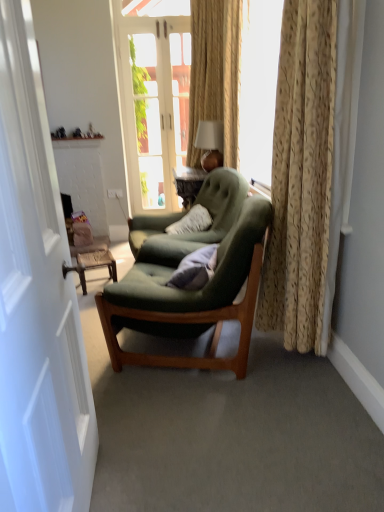
Question: Which direction should I rotate to look at white glass door at center, which is the second door in front-to-back order?

Choices:
 (A) right
 (B) left

Answer: (B)

Question: Should I look upward or downward to see gold textured curtain at right?

Choices:
 (A) up
 (B) down

Answer: (A)

Question: Is velvet blue pillow at center next to white glass door at center, which is the second door in front-to-back order, and touching it?

Choices:
 (A) yes
 (B) no

Answer: (B)

Question: From a real-world perspective, is velvet blue pillow at center over white glass door at center, which is the second door in front-to-back order?

Choices:
 (A) no
 (B) yes

Answer: (A)

Question: Can you confirm if velvet blue pillow at center is wider than white glass door at center, the first door viewed from the top?

Choices:
 (A) yes
 (B) no

Answer: (A)

Question: From the image's perspective, is velvet blue pillow at center under white glass door at center, acting as the 2th door starting from the bottom?

Choices:
 (A) no
 (B) yes

Answer: (B)

Question: Is velvet blue pillow at center far from white glass door at center, which is the first door in back-to-front order?

Choices:
 (A) yes
 (B) no

Answer: (A)

Question: From the image's perspective, is velvet blue pillow at center located above white glass door at center, the first door viewed from the top?

Choices:
 (A) yes
 (B) no

Answer: (B)

Question: Can you confirm if matte white table lamp at upper center is positioned to the left of velvet blue pillow at center?

Choices:
 (A) yes
 (B) no

Answer: (B)

Question: Is matte white table lamp at upper center wider than velvet blue pillow at center?

Choices:
 (A) no
 (B) yes

Answer: (B)

Question: Would you say matte white table lamp at upper center is a long distance from velvet blue pillow at center?

Choices:
 (A) yes
 (B) no

Answer: (A)

Question: Does matte white table lamp at upper center lie behind velvet blue pillow at center?

Choices:
 (A) yes
 (B) no

Answer: (A)

Question: Can you confirm if matte white table lamp at upper center is smaller than velvet blue pillow at center?

Choices:
 (A) yes
 (B) no

Answer: (B)

Question: Is matte white table lamp at upper center turned away from velvet blue pillow at center?

Choices:
 (A) no
 (B) yes

Answer: (A)

Question: From the image's perspective, is velvet blue pillow at center below matte white table lamp at upper center?

Choices:
 (A) no
 (B) yes

Answer: (B)